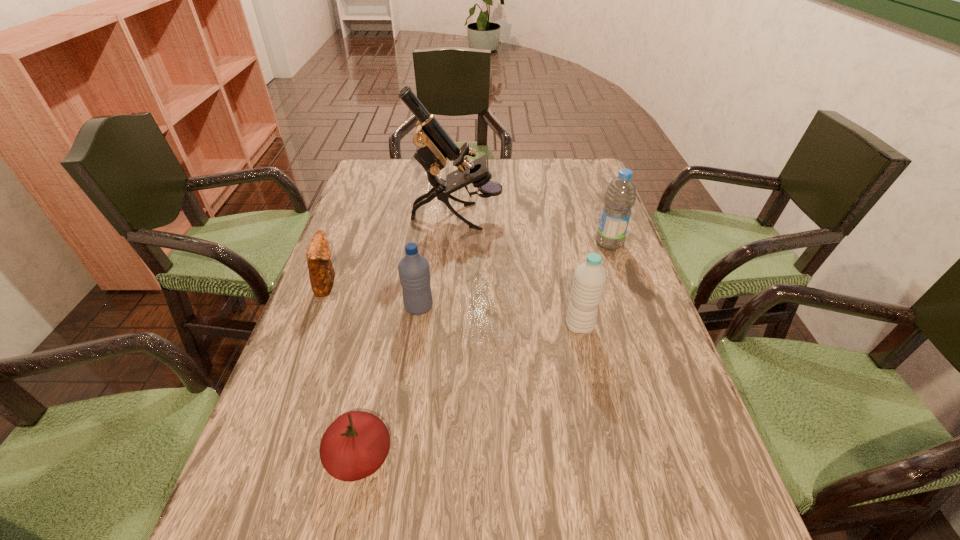
The image size is (960, 540). Identify the location of vacant point located between the farthest object and the leftmost water bottle. (438, 262).

This screenshot has width=960, height=540. In order to click on unoccupied area between the farthest object and the fifth object from left to right in this screenshot , I will do `click(518, 272)`.

Select which object is the fourth closest to the microscope. Please provide its 2D coordinates. Your answer should be formatted as a tuple, i.e. [(x, y)], where the tuple contains the x and y coordinates of a point satisfying the conditions above.

[(589, 280)]

Identify which object is located as the fifth nearest to the second water bottle from right to left. Please provide its 2D coordinates. Your answer should be formatted as a tuple, i.e. [(x, y)], where the tuple contains the x and y coordinates of a point satisfying the conditions above.

[(321, 272)]

Locate which water bottle ranks in proximity to the leftmost water bottle. Please provide its 2D coordinates. Your answer should be formatted as a tuple, i.e. [(x, y)], where the tuple contains the x and y coordinates of a point satisfying the conditions above.

[(589, 280)]

Where is `water bottle that is the third closest to the clutch bag`? The image size is (960, 540). water bottle that is the third closest to the clutch bag is located at coordinates (620, 196).

You are a GUI agent. You are given a task and a screenshot of the screen. Output one action in this format:
    pyautogui.click(x=<x>, y=<y>)
    Task: Click on the free spot that satisfies the following two spatial constraints: 1. on the front side of the rightmost water bottle; 2. on the open side of the fifth tallest object
    
    Given the screenshot: What is the action you would take?
    pyautogui.click(x=623, y=284)

Where is `blank area in the image that satisfies the following two spatial constraints: 1. through the eyepiece of the second water bottle from right to left; 2. on the right side of the microscope`? The height and width of the screenshot is (540, 960). blank area in the image that satisfies the following two spatial constraints: 1. through the eyepiece of the second water bottle from right to left; 2. on the right side of the microscope is located at coordinates (449, 327).

Where is `vacant area that satisfies the following two spatial constraints: 1. on the open side of the fifth tallest object; 2. on the left side of the second object from right to left`? vacant area that satisfies the following two spatial constraints: 1. on the open side of the fifth tallest object; 2. on the left side of the second object from right to left is located at coordinates (311, 327).

This screenshot has width=960, height=540. I want to click on vacant space that satisfies the following two spatial constraints: 1. through the eyepiece of the microscope; 2. on the front side of the leftmost water bottle, so click(x=451, y=307).